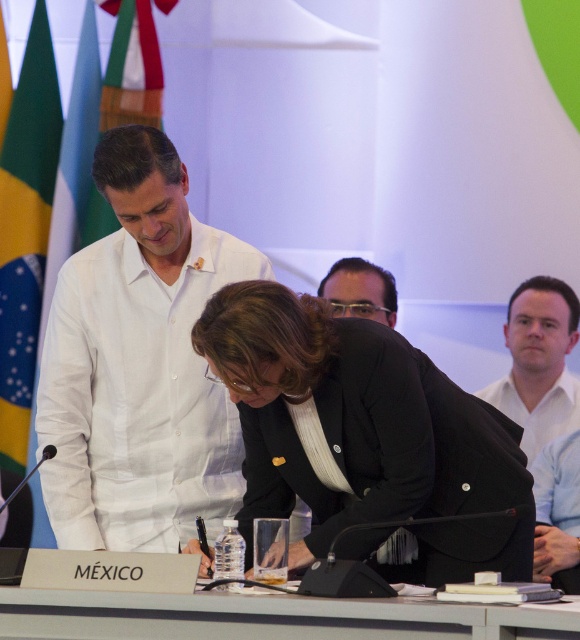
Between green fabric flag at left and brown hair at center, which one is positioned higher?

green fabric flag at left

How distant is green fabric flag at left from brown hair at center?

green fabric flag at left is 5.57 feet away from brown hair at center.

Does point (5, 218) lie in front of point (339, 272)?

No, (5, 218) is behind (339, 272).

Where is `green fabric flag at left`? green fabric flag at left is located at coordinates (26, 230).

Who is higher up, black matte blazer at center or white linen shirt at center?

white linen shirt at center is above.

Can you confirm if black matte blazer at center is taller than white linen shirt at center?

No.

Between point (278, 326) and point (137, 468), which one is positioned behind?

Positioned behind is point (137, 468).

At what (x,y) coordinates should I click in order to perform the action: click on black matte blazer at center. Please return your answer as a coordinate pair (x, y). The image size is (580, 640). Looking at the image, I should click on (364, 438).

Does point (39, 4) come behind point (509, 381)?

That is True.

Is green fabric flag at left below white shirt at right?

No.

Between point (41, 38) and point (536, 332), which one is positioned in front?

Point (536, 332) is more forward.

Image resolution: width=580 pixels, height=640 pixels. I want to click on green fabric flag at left, so click(26, 230).